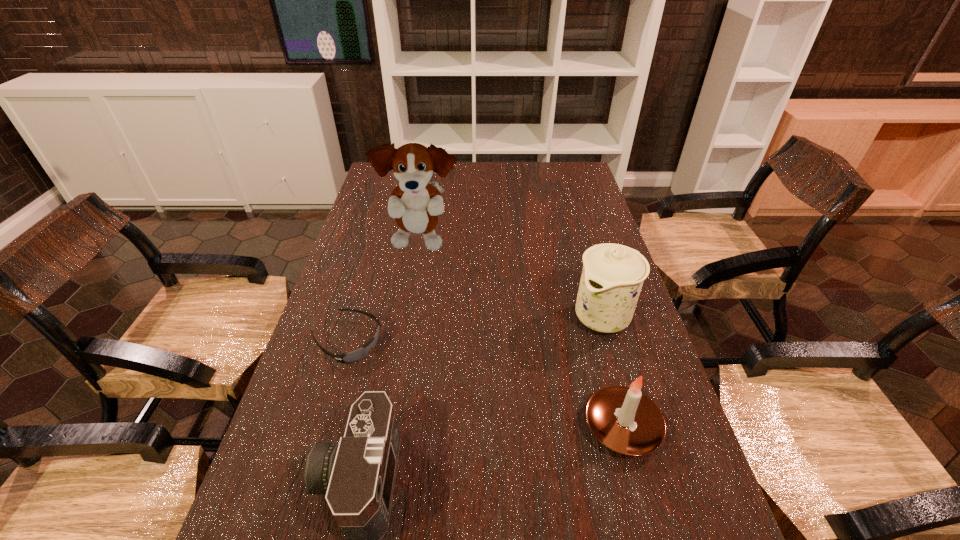
The image size is (960, 540). In order to click on vacant space at the left edge of the desktop in this screenshot , I will do `click(309, 388)`.

At what (x,y) coordinates should I click in order to perform the action: click on vacant area at the right edge of the desktop. Please return your answer as a coordinate pair (x, y). The image size is (960, 540). Looking at the image, I should click on (636, 362).

What are the coordinates of `vacant space at the far left corner` in the screenshot? It's located at (377, 181).

Image resolution: width=960 pixels, height=540 pixels. I want to click on vacant region at the far right corner of the desktop, so click(x=556, y=188).

Where is `free space at the near right corner of the desktop`? free space at the near right corner of the desktop is located at coordinates (645, 518).

Locate an element on the screen. Image resolution: width=960 pixels, height=540 pixels. empty space between the farthest object and the shortest object is located at coordinates (384, 292).

I want to click on vacant point located between the farthest object and the third shortest object, so click(522, 335).

Find the location of a particular element. Image resolution: width=960 pixels, height=540 pixels. vacant area that lies between the third tallest object and the sunglasses is located at coordinates (485, 384).

You are a GUI agent. You are given a task and a screenshot of the screen. Output one action in this format:
    pyautogui.click(x=<x>, y=<y>)
    Task: Click on the unoccupied position between the fourth shortest object and the candle
    
    Given the screenshot: What is the action you would take?
    pyautogui.click(x=613, y=372)

Image resolution: width=960 pixels, height=540 pixels. I want to click on unoccupied position between the tallest object and the third tallest object, so click(522, 335).